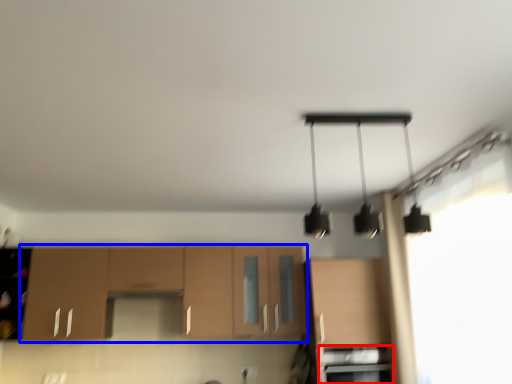
Question: Which object is closer to the camera taking this photo, oven (highlighted by a red box) or cabinetry (highlighted by a blue box)?

Choices:
 (A) oven
 (B) cabinetry

Answer: (A)